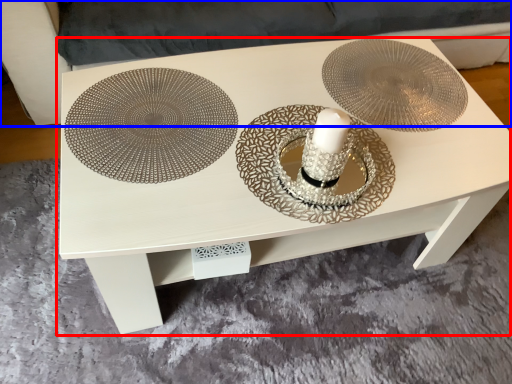
Question: Which object appears farthest to the camera in this image, table (highlighted by a red box) or couch (highlighted by a blue box)?

Choices:
 (A) table
 (B) couch

Answer: (B)